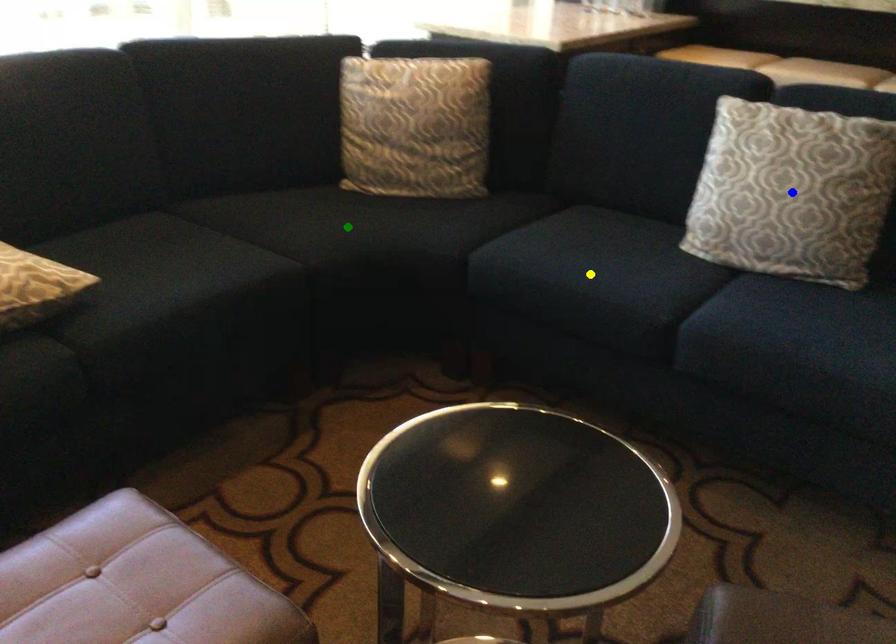
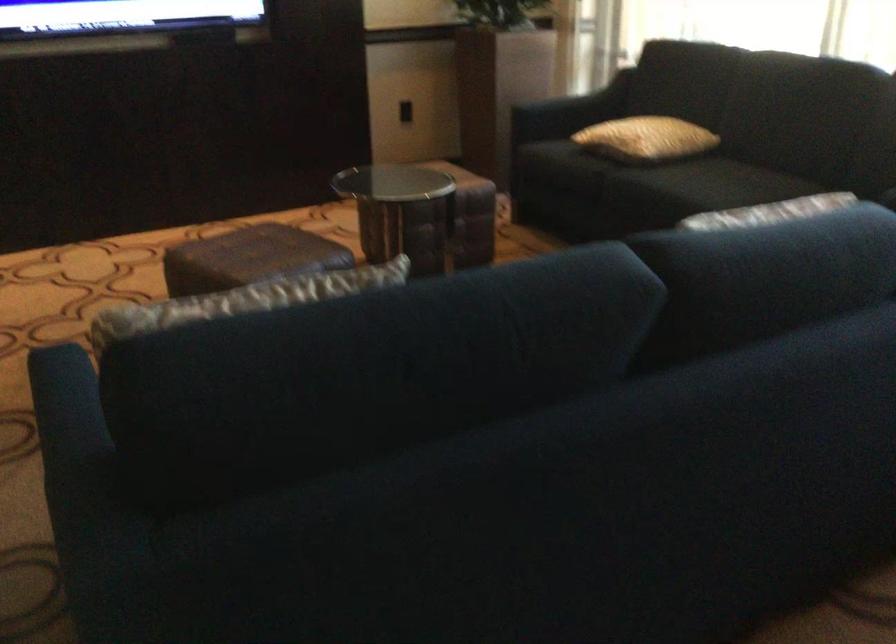
I am providing you with two images of the same scene from different viewpoints. Three points are marked in image1. Which point corresponds to a part or object that is occluded in image2?In image1, three points are marked. Which of them correspond to a part or object that is occluded in image2?Among the three points shown in image1, which one corresponds to a part or object that is no longer visible due to occlusion in image2?

yellow point, green point, blue point cannot be seen in image2.